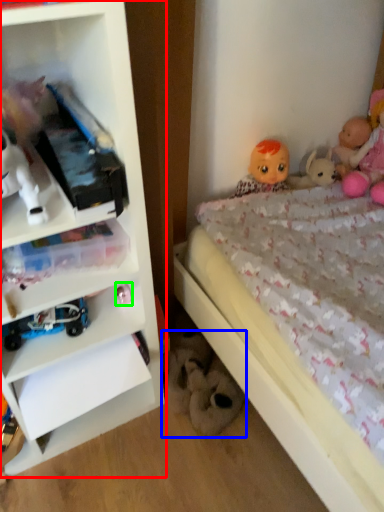
Question: Which is farther away from shelf (highlighted by a red box)? toy (highlighted by a blue box) or toy (highlighted by a green box)?

Choices:
 (A) toy
 (B) toy

Answer: (A)